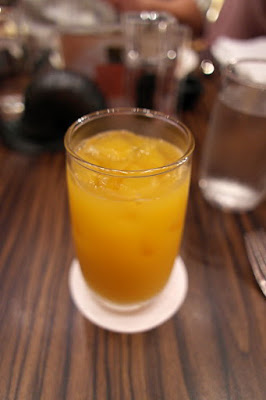
Identify the location of white saucer. The image size is (266, 400). (108, 317).